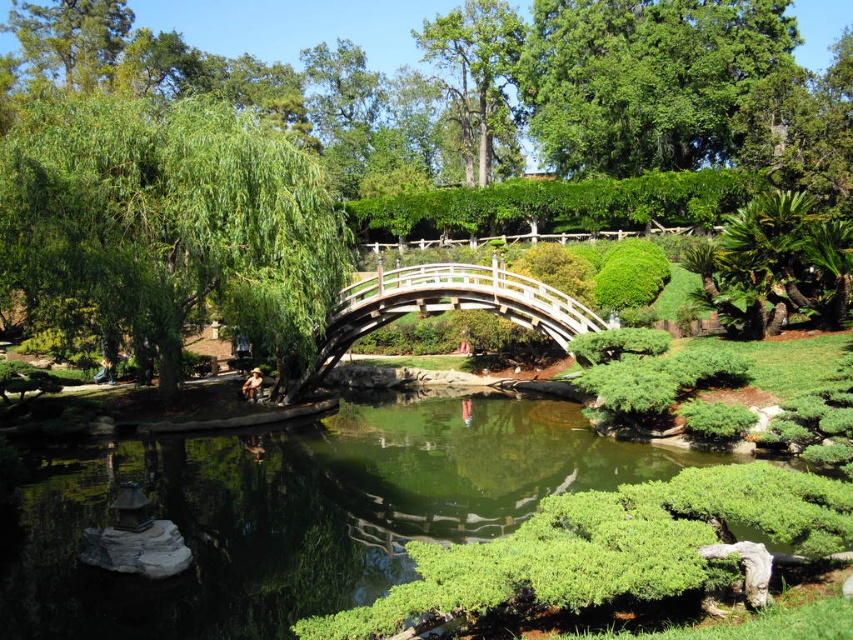
In the Japanese garden scene, you see the green reflective water at center and the green leafy tree at left. From the perspective of an observer standing at the right edge of the pond, which object is positioned to the left?

The green leafy tree at left is positioned to the left of the green reflective water at center when viewed from the right edge of the pond.

You are a gardener planning to place a 2 meter wide decorative stone path between the green reflective water at center and the green leafy tree at left. Based on their widths, will the path fit without overlapping either?

The green reflective water at center might be wider than green leafy tree at left, so the 2 meter wide path may or may not fit depending on their exact widths. More precise measurements are needed to determine this.

You are standing at the entrance of the garden and want to take a photo of the green leafy tree at center. According to the garden layout, where should you position yourself to capture the tree in the frame?

To capture the green leafy tree at center in the frame, you should position yourself at the entrance of the garden since the tree is located at point (526, 92) in the 2D layout, which would be visible from that vantage point.